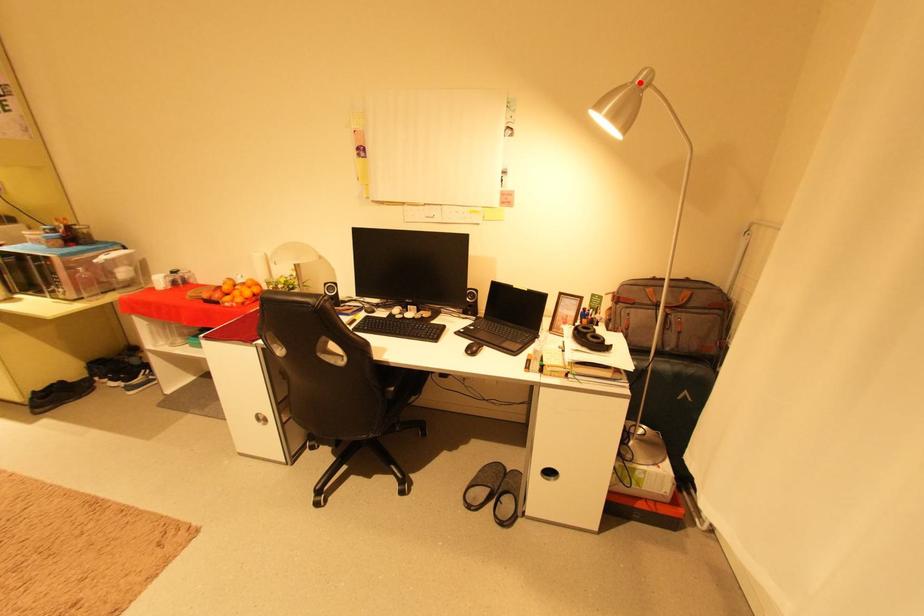
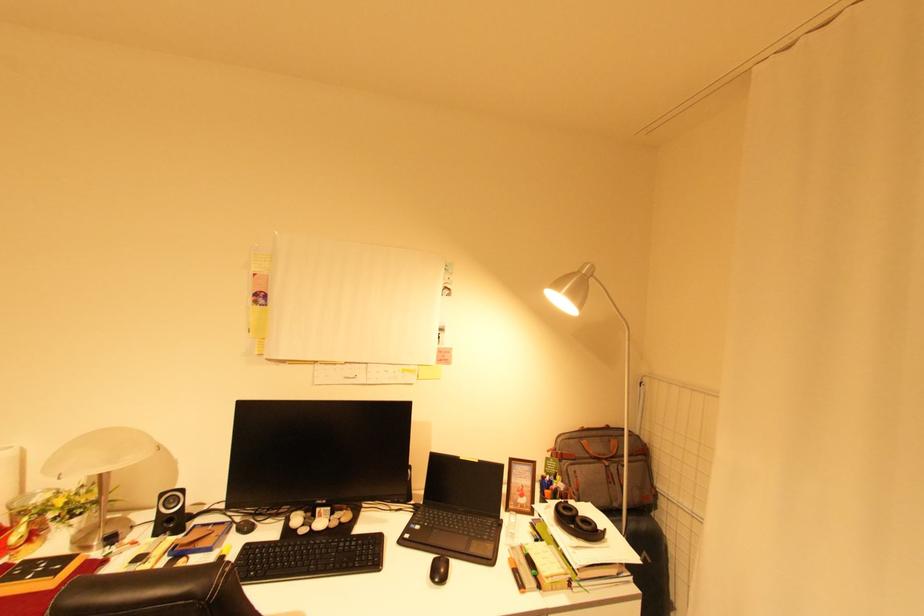
Question: I am providing you with two images of the same scene from different viewpoints. A red point is marked on the first image. At the location where the point appears in image 1, is it still visible in image 2?

Choices:
 (A) Yes
 (B) No

Answer: (A)